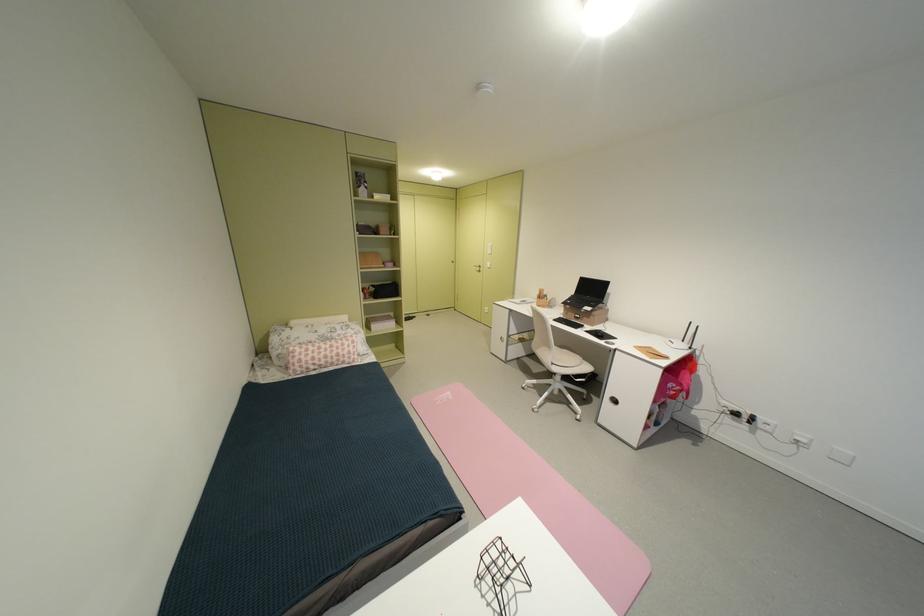
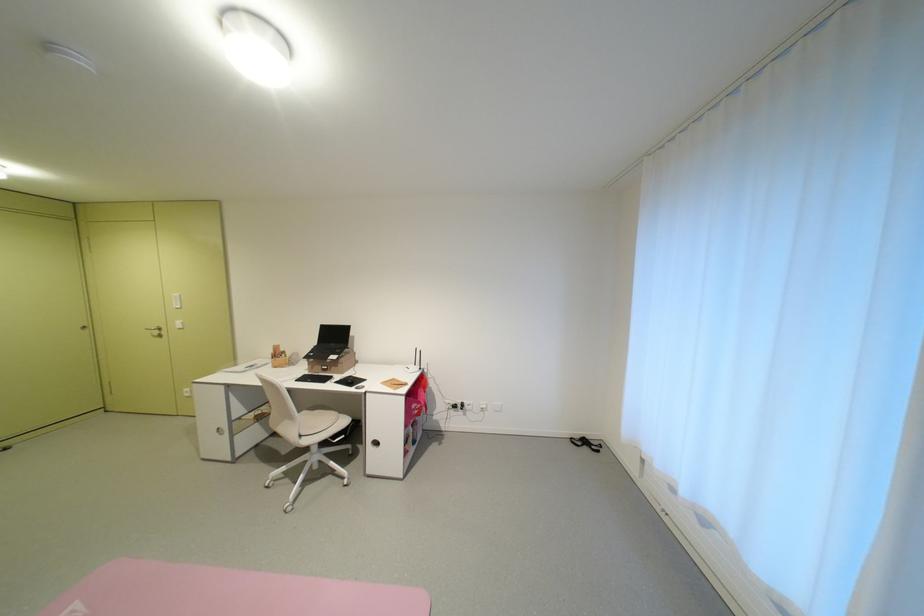
The point at (682, 389) is marked in the first image. Where is the corresponding point in the second image?

(424, 408)